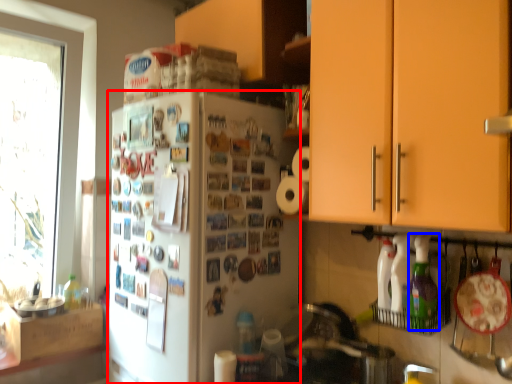
Question: Which object is closer to the camera taking this photo, refrigerator (highlighted by a red box) or bottle (highlighted by a blue box)?

Choices:
 (A) refrigerator
 (B) bottle

Answer: (B)